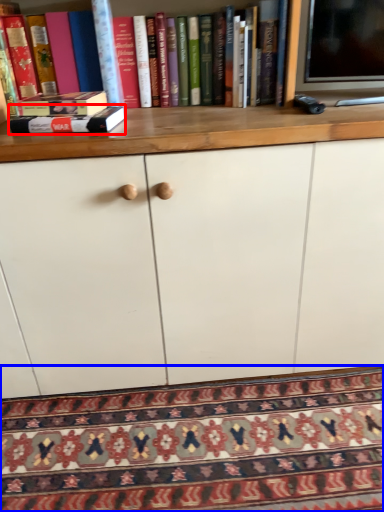
Question: Which object is closer to the camera taking this photo, book (highlighted by a red box) or mat (highlighted by a blue box)?

Choices:
 (A) book
 (B) mat

Answer: (B)